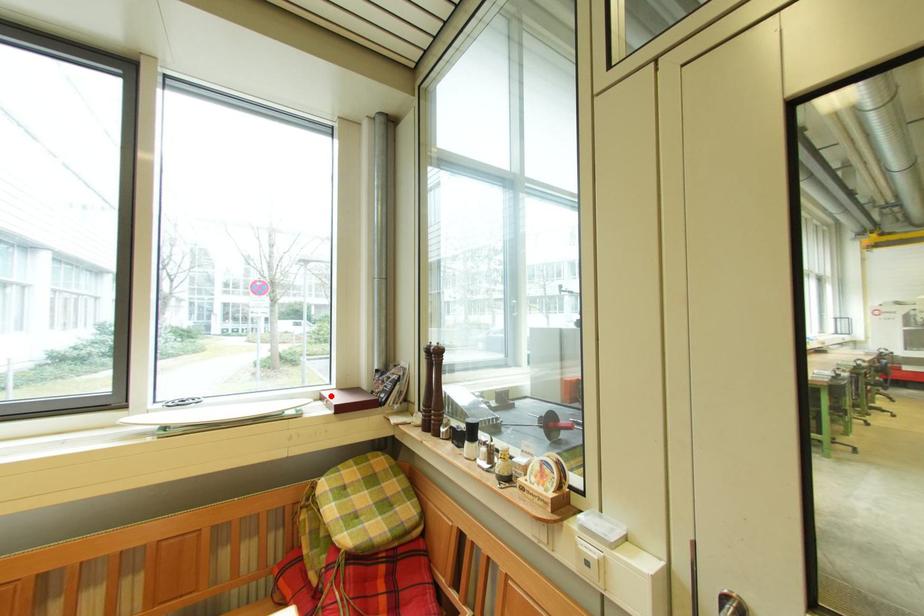
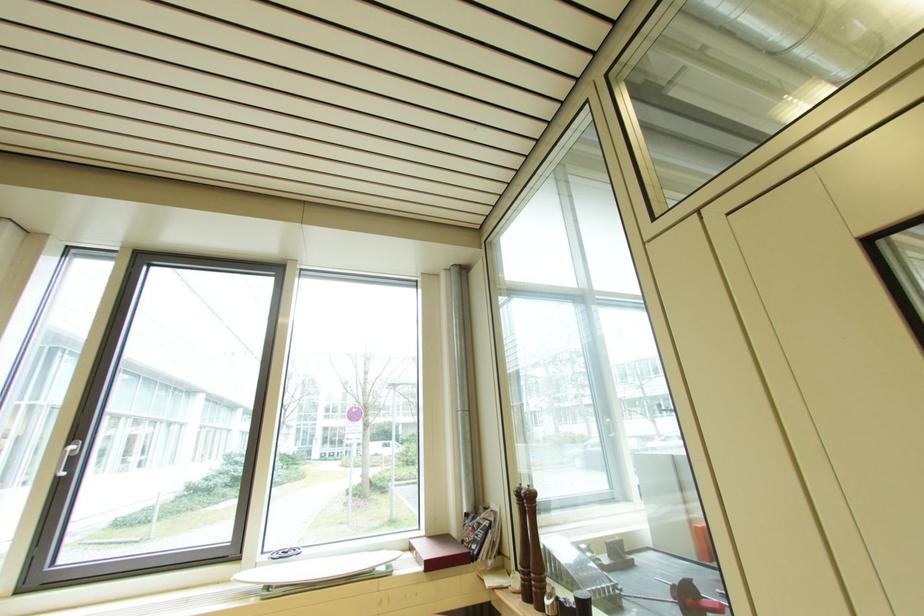
Where in the second image is the point corresponding to the highlighted location from the first image?

(420, 545)